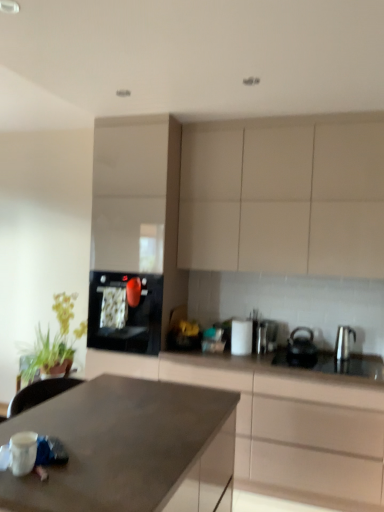
Question: In terms of width, does green leafy plant at left look wider or thinner when compared to matte gray countertop at center?

Choices:
 (A) thin
 (B) wide

Answer: (A)

Question: Is green leafy plant at left inside the boundaries of matte gray countertop at center, or outside?

Choices:
 (A) inside
 (B) outside

Answer: (B)

Question: Estimate the real-world distances between objects in this image. Which object is farther from the green leafy plant at left?

Choices:
 (A) white matte cabinet at upper center, the 2th cabinetry viewed from the front
 (B) black matte kettle at right, the 2th kitchen appliance from the right
 (C) satin metallic toaster at center, which is counted as the 1th appliance, starting from the right
 (D) satin silver kettle at right, placed as the 3th kitchen appliance when sorted from left to right
 (E) white glossy cabinet at center, marked as the third cabinetry in a front-to-back arrangement

Answer: (D)

Question: Estimate the real-world distances between objects in this image. Which object is farther from the green leafy plant at left?

Choices:
 (A) satin metallic toaster at center, which ranks as the 2th appliance in left-to-right order
 (B) satin silver kettle at right, marked as the first kitchen appliance in a right-to-left arrangement
 (C) white matte cabinet at upper center, placed as the second cabinetry when sorted from back to front
 (D) matte brown cabinet at center, the first cabinetry positioned from the front
 (E) white glossy cup at upper center, placed as the second appliance when sorted from right to left

Answer: (B)